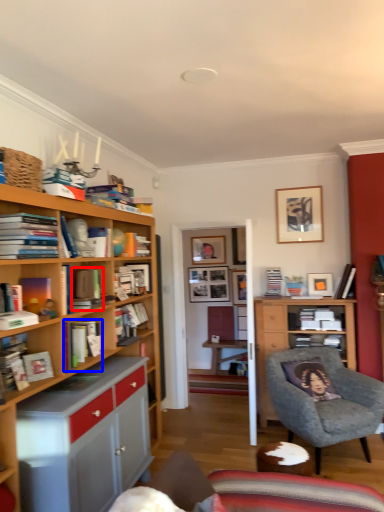
Question: Which of the following is the closest to the observer, book (highlighted by a red box) or book (highlighted by a blue box)?

Choices:
 (A) book
 (B) book

Answer: (A)